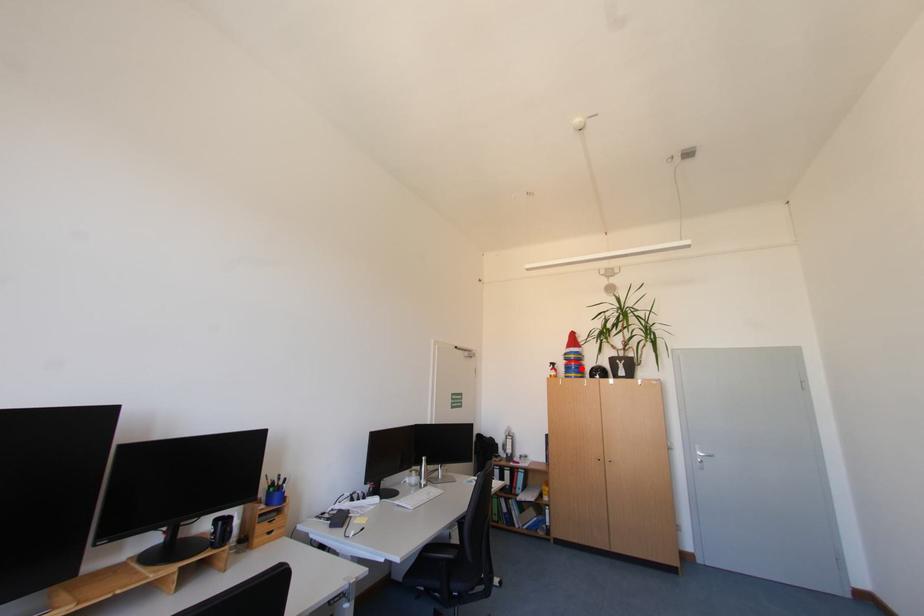
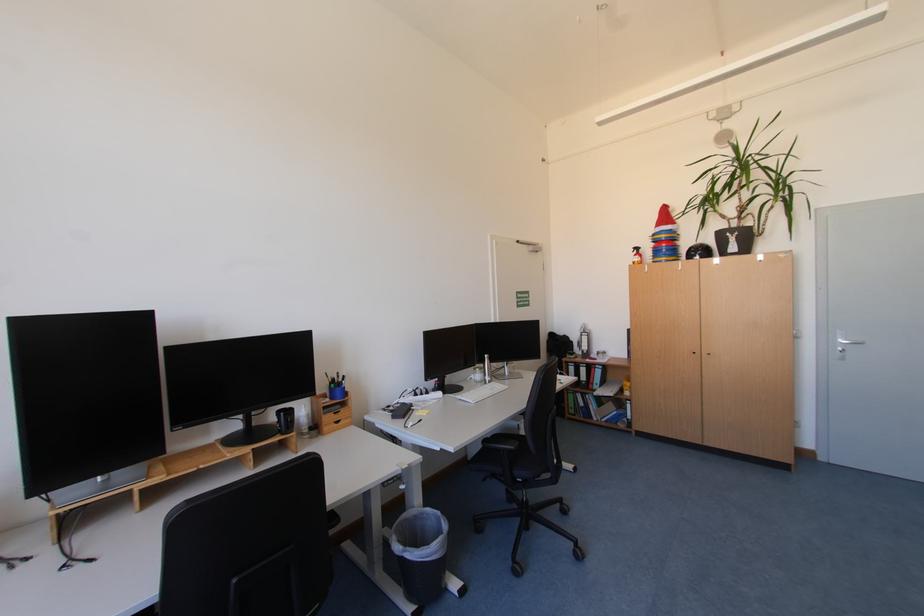
Question: I am providing you with two images of the same scene from different viewpoints. Given a red point in image1, look at the same physical point in image2. Is it:

Choices:
 (A) Closer to the viewpoint
 (B) Farther from the viewpoint

Answer: (A)